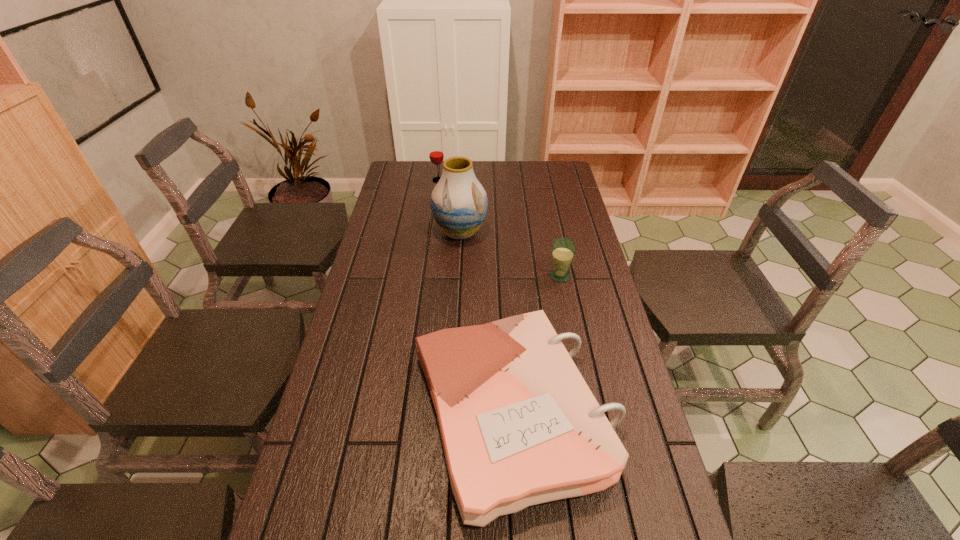
At what (x,y) coordinates should I click in order to perform the action: click on the second farthest object. Please return your answer as a coordinate pair (x, y). The width and height of the screenshot is (960, 540). Looking at the image, I should click on (459, 202).

Where is `vase`? The height and width of the screenshot is (540, 960). vase is located at coordinates (459, 202).

This screenshot has height=540, width=960. I want to click on the third shortest object, so click(x=436, y=154).

Where is `the taller glass`? The image size is (960, 540). the taller glass is located at coordinates (436, 154).

Locate an element on the screen. This screenshot has width=960, height=540. the nearer glass is located at coordinates (563, 249).

Where is `the second nearest object`? Image resolution: width=960 pixels, height=540 pixels. the second nearest object is located at coordinates (563, 249).

Where is `the nearest object`? the nearest object is located at coordinates (519, 425).

Where is `free space located on the front of the vase`? Image resolution: width=960 pixels, height=540 pixels. free space located on the front of the vase is located at coordinates (454, 338).

Locate an element on the screen. This screenshot has width=960, height=540. vacant space located on the right of the farther glass is located at coordinates (494, 180).

Where is `vacant space located 0.060m on the front of the right glass`? Image resolution: width=960 pixels, height=540 pixels. vacant space located 0.060m on the front of the right glass is located at coordinates (564, 297).